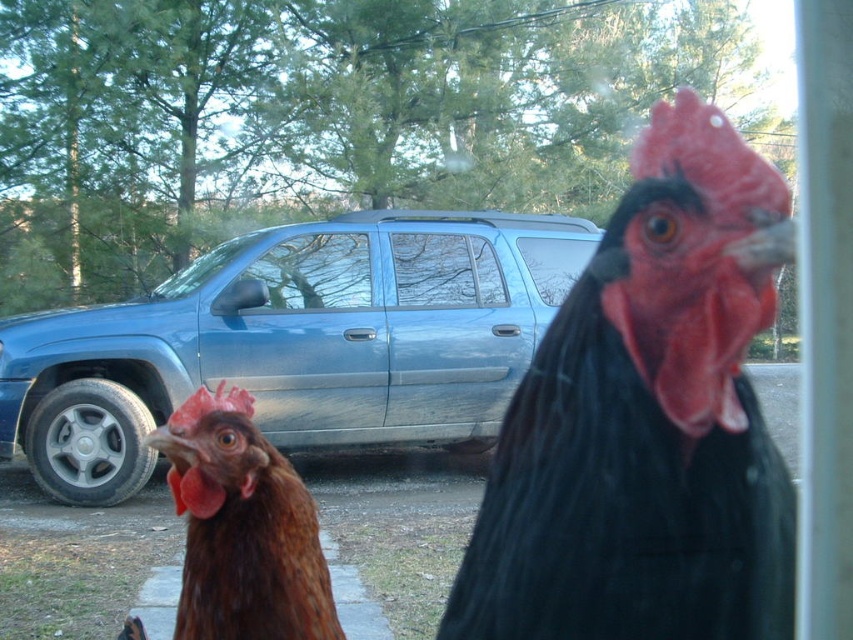
Question: Estimate the real-world distances between objects in this image. Which object is closer to the blue metallic car at center?

Choices:
 (A) brown feathered chicken at lower left
 (B) black glossy rooster at center

Answer: (A)

Question: Is black glossy rooster at center wider than blue metallic car at center?

Choices:
 (A) no
 (B) yes

Answer: (A)

Question: Can you confirm if black glossy rooster at center is smaller than brown feathered chicken at lower left?

Choices:
 (A) no
 (B) yes

Answer: (A)

Question: Which object is positioned farthest from the blue metallic car at center?

Choices:
 (A) brown feathered chicken at lower left
 (B) black glossy rooster at center

Answer: (B)

Question: Which is nearer to the blue metallic car at center?

Choices:
 (A) black glossy rooster at center
 (B) brown feathered chicken at lower left

Answer: (B)

Question: Is black glossy rooster at center above blue metallic car at center?

Choices:
 (A) yes
 (B) no

Answer: (A)